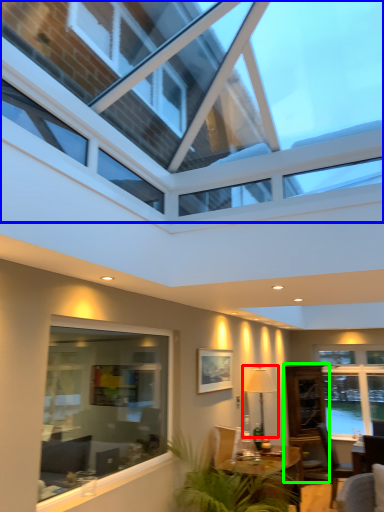
Question: Which object is the farthest from lamp (highlighted by a red box)? Choose among these: window (highlighted by a blue box) or glass door (highlighted by a green box).

Choices:
 (A) window
 (B) glass door

Answer: (A)